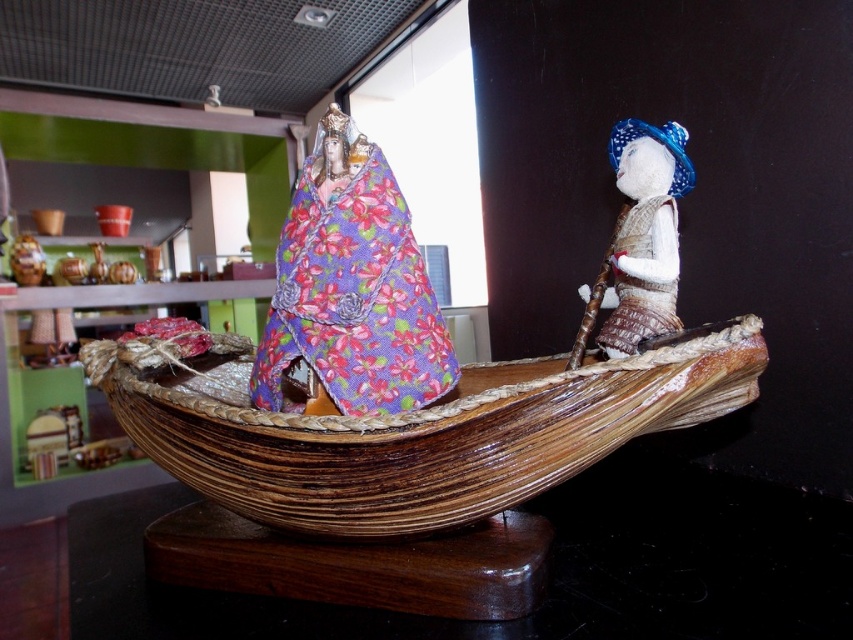
Which is in front, point (334, 116) or point (653, 284)?

Point (334, 116) is in front.

The image size is (853, 640). What do you see at coordinates (392, 388) in the screenshot? I see `wooden boat at center` at bounding box center [392, 388].

Measure the distance between wooden boat at center and camera.

wooden boat at center is 84.33 centimeters from camera.

In order to click on wooden boat at center in this screenshot , I will do `click(392, 388)`.